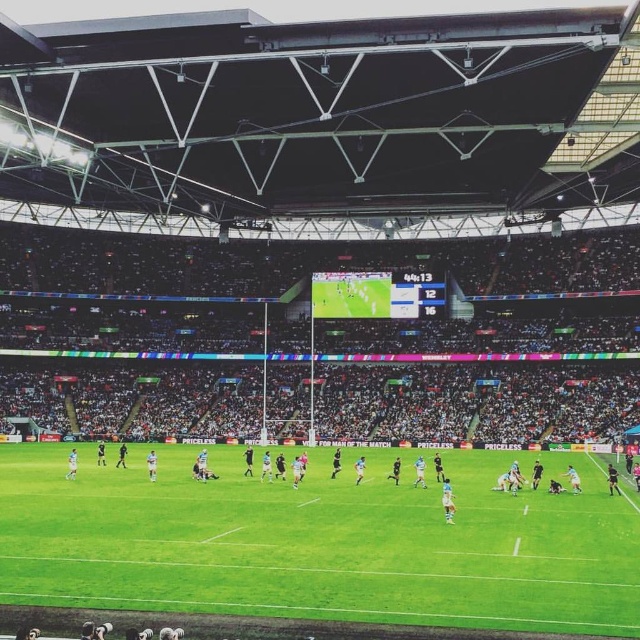
You are a groundskeeper responsible for maintaining the football field. You need to water both the green grass football field at center and the white synthetic grass at center. Which area requires more water?

The green grass football field at center requires more water because it is larger in size than the white synthetic grass at center, and natural grass typically needs more hydration than synthetic surfaces.

Looking at this image, you are a spectator sitting in the stands of the rugby stadium. You notice two areas on the field at the center. Which area is closer to you, the green grass football field at center or the white synthetic grass at center?

The green grass football field at center is closer to the viewer than the white synthetic grass at center.

You are a groundskeeper responsible for maintaining the stadium field. You notice that the green grass football field at center is covering part of the white synthetic grass at center. Which surface should you prioritize for maintenance today?

The green grass football field at center is positioned over white synthetic grass at center, so you should prioritize maintaining the green grass football field at center first since it is the top layer and requires immediate attention.